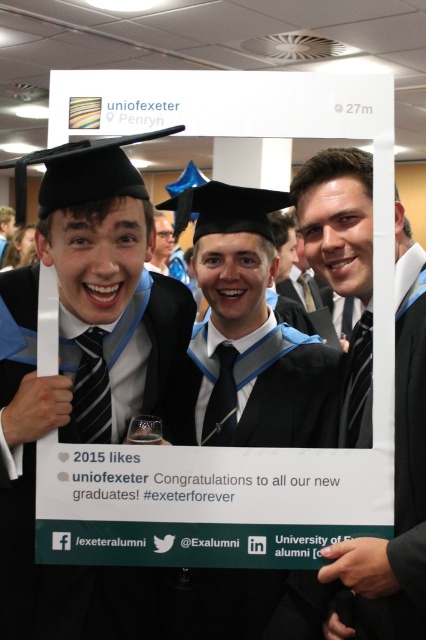
Which is more to the right, matte black graduation cap at left or matte black suit at center?

matte black suit at center is more to the right.

Who is higher up, matte black graduation cap at left or matte black suit at center?

matte black suit at center is higher up.

Which is behind, point (118, 275) or point (354, 444)?

The point (354, 444) is more distant.

This screenshot has height=640, width=426. Find the location of `matte black graduation cap at left`. matte black graduation cap at left is located at coordinates (83, 376).